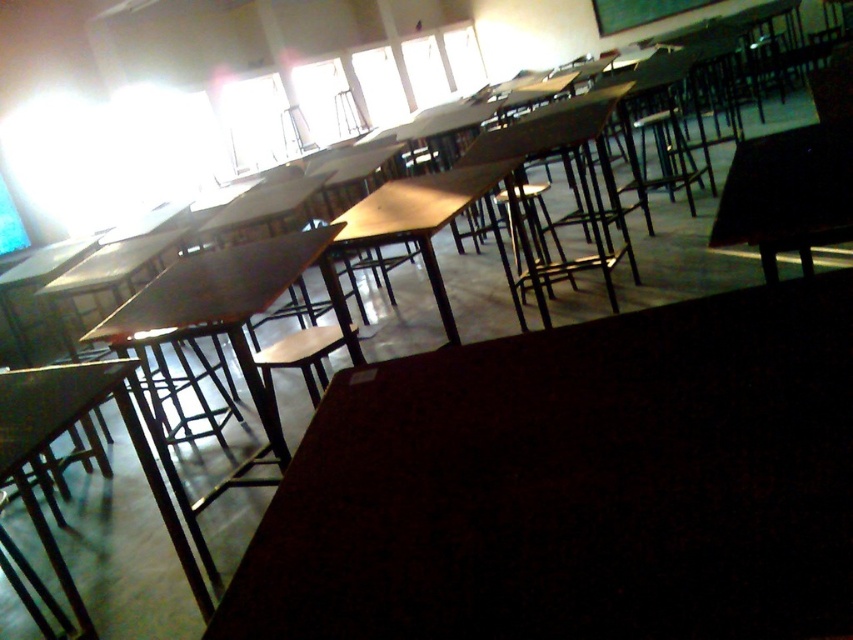
You are standing at the entrance of the classroom and notice the matte black table at lower left. Based on its position, can you estimate whether it is closer to the front or the back of the room?

The matte black table at lower left is located at point (65, 429), which suggests it is closer to the front of the room since the lower left coordinates typically indicate proximity to the front in such layouts.

In the scene shown: You are a student carrying a large project board that is 5 feet wide. You need to walk from the black glossy table at right to the wooden table at center. Is there enough space to move the board between them without tilting it?

The distance between the black glossy table at right and the wooden table at center is 4.65 feet, which is shorter than the 5 feet width of the project board. Therefore, there isn not enough space to move the board between them without tilting it.